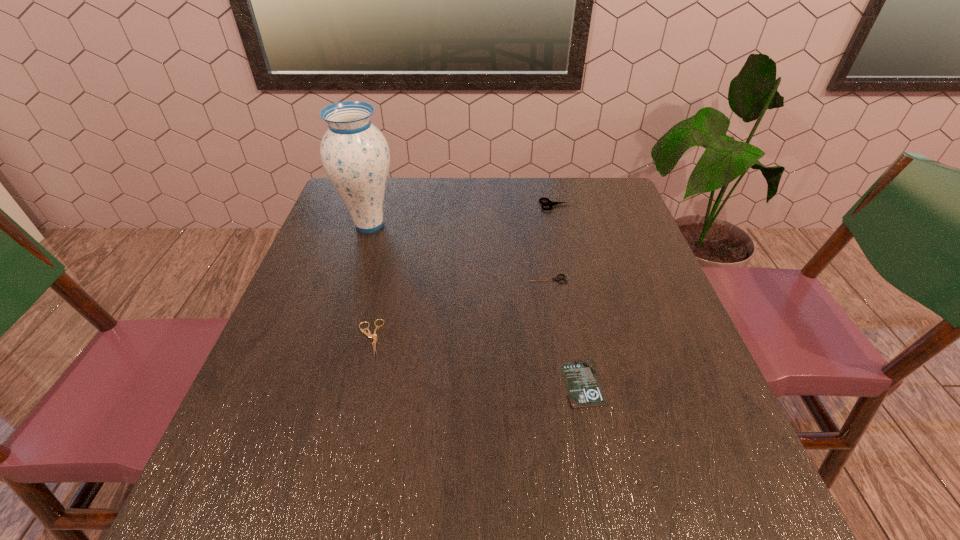
The height and width of the screenshot is (540, 960). In the image, there is a desktop. Identify the location of vacant region at the near edge. (312, 492).

Where is `vacant space at the left edge of the desktop`? Image resolution: width=960 pixels, height=540 pixels. vacant space at the left edge of the desktop is located at coordinates (294, 391).

Image resolution: width=960 pixels, height=540 pixels. In order to click on free space at the right edge of the desktop in this screenshot , I will do pyautogui.click(x=670, y=348).

What are the coordinates of `blank space at the far left corner of the desktop` in the screenshot? It's located at (337, 208).

Identify the location of vacant space at the far right corner of the desktop. This screenshot has width=960, height=540. (620, 207).

This screenshot has height=540, width=960. In order to click on vacant area between the shortest object and the shortest shears in this screenshot , I will do `click(476, 361)`.

The image size is (960, 540). What are the coordinates of `vacant space in between the tallest shears and the identity card` in the screenshot? It's located at (570, 294).

Where is `unoccupied position between the shortest object and the vase`? unoccupied position between the shortest object and the vase is located at coordinates (476, 304).

At what (x,y) coordinates should I click in order to perform the action: click on empty space between the tallest object and the identity card. Please return your answer as a coordinate pair (x, y). Looking at the image, I should click on (476, 304).

Identify the location of empty location between the identity card and the second nearest shears. (565, 331).